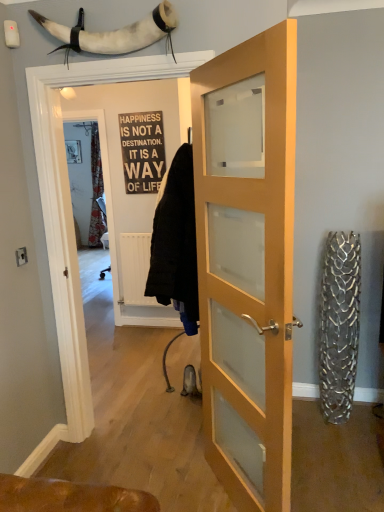
Question: Considering the relative sizes of light wood/glass door at center and white horn at upper center in the image provided, is light wood/glass door at center wider than white horn at upper center?

Choices:
 (A) yes
 (B) no

Answer: (B)

Question: Does light wood/glass door at center lie in front of white horn at upper center?

Choices:
 (A) yes
 (B) no

Answer: (A)

Question: From the image's perspective, is light wood/glass door at center above white horn at upper center?

Choices:
 (A) no
 (B) yes

Answer: (A)

Question: Is light wood/glass door at center thinner than white horn at upper center?

Choices:
 (A) yes
 (B) no

Answer: (A)

Question: Would you consider light wood/glass door at center to be distant from white horn at upper center?

Choices:
 (A) yes
 (B) no

Answer: (B)

Question: Is white horn at upper center taller or shorter than light wood/glass door at center?

Choices:
 (A) tall
 (B) short

Answer: (B)

Question: Considering the positions of white horn at upper center and light wood/glass door at center in the image, is white horn at upper center wider or thinner than light wood/glass door at center?

Choices:
 (A) wide
 (B) thin

Answer: (A)

Question: From a real-world perspective, relative to light wood/glass door at center, is white horn at upper center vertically above or below?

Choices:
 (A) above
 (B) below

Answer: (A)

Question: Is white horn at upper center bigger or smaller than light wood/glass door at center?

Choices:
 (A) small
 (B) big

Answer: (A)

Question: From the image's perspective, is white horn at upper center above or below black wood sign at center?

Choices:
 (A) below
 (B) above

Answer: (B)

Question: Considering the positions of point (157, 26) and point (130, 178), is point (157, 26) closer or farther from the camera than point (130, 178)?

Choices:
 (A) closer
 (B) farther

Answer: (A)

Question: In terms of height, does white horn at upper center look taller or shorter compared to black wood sign at center?

Choices:
 (A) short
 (B) tall

Answer: (A)

Question: Is white horn at upper center wider or thinner than black wood sign at center?

Choices:
 (A) wide
 (B) thin

Answer: (A)

Question: Based on their positions, is light wood/glass door at center located to the left or right of black wood sign at center?

Choices:
 (A) left
 (B) right

Answer: (B)

Question: From their relative heights in the image, would you say light wood/glass door at center is taller or shorter than black wood sign at center?

Choices:
 (A) short
 (B) tall

Answer: (B)